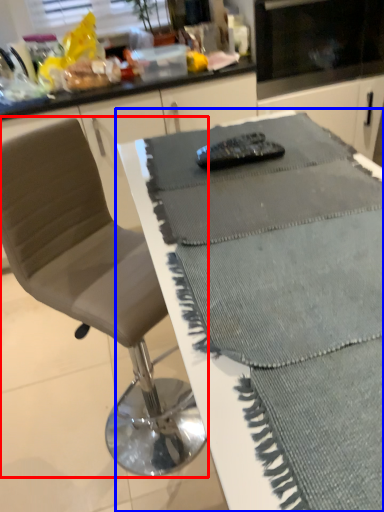
Question: Which object appears closest to the camera in this image, chair (highlighted by a red box) or table (highlighted by a blue box)?

Choices:
 (A) chair
 (B) table

Answer: (B)